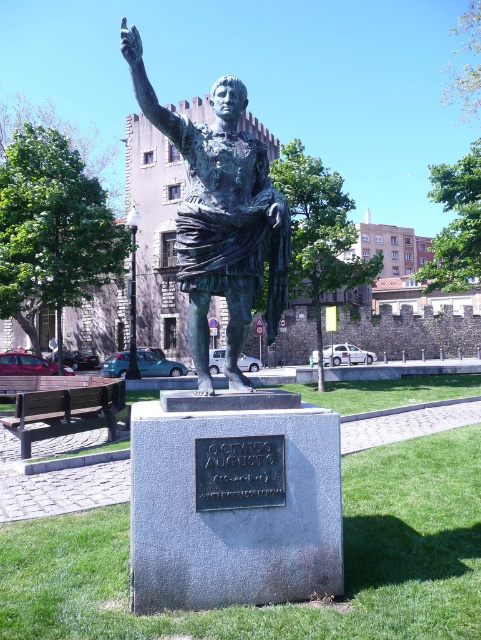
Question: Considering the relative positions of bronze statue at center and black metal plaque at center in the image provided, where is bronze statue at center located with respect to black metal plaque at center?

Choices:
 (A) right
 (B) left

Answer: (B)

Question: Which object is closer to the camera taking this photo?

Choices:
 (A) bronze statue at center
 (B) black metal plaque at center

Answer: (A)

Question: Does bronze statue at center appear on the left side of black metal plaque at center?

Choices:
 (A) no
 (B) yes

Answer: (B)

Question: Can you confirm if bronze statue at center is positioned to the left of black metal plaque at center?

Choices:
 (A) no
 (B) yes

Answer: (B)